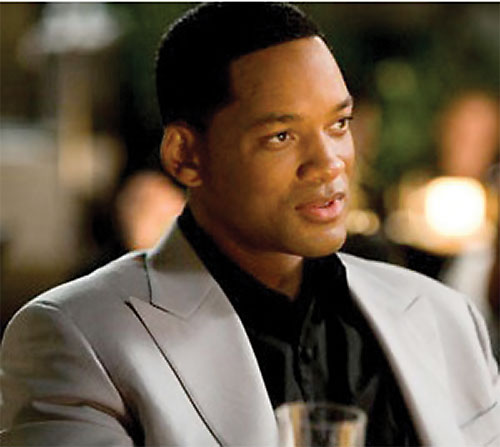
I want to click on light, so click(x=450, y=212).